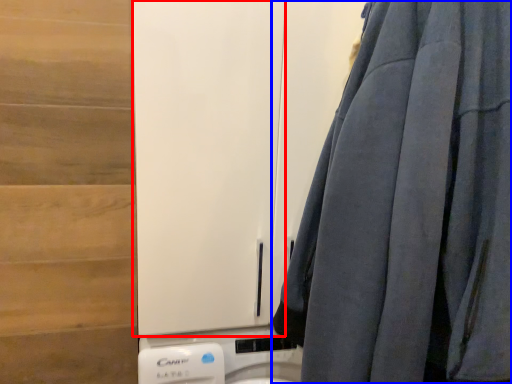
Question: Among these objects, which one is nearest to the camera, barn door (highlighted by a red box) or curtain (highlighted by a blue box)?

Choices:
 (A) barn door
 (B) curtain

Answer: (B)